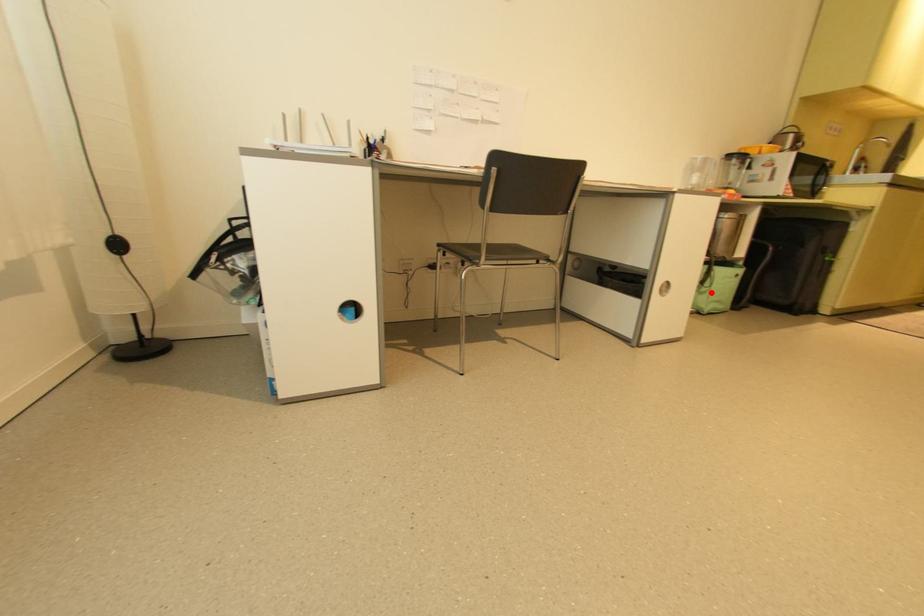
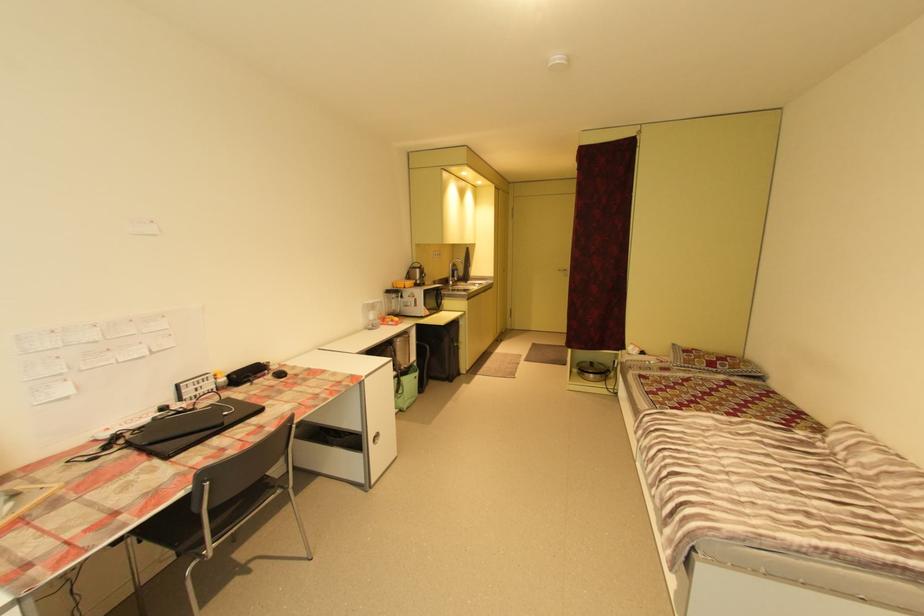
The point at the highlighted location is marked in the first image. Where is the corresponding point in the second image?

(407, 397)